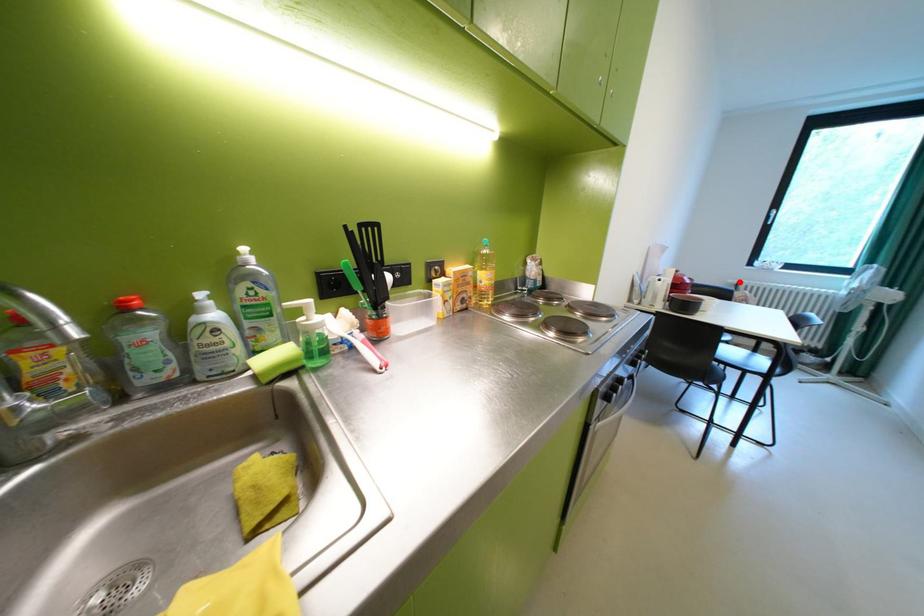
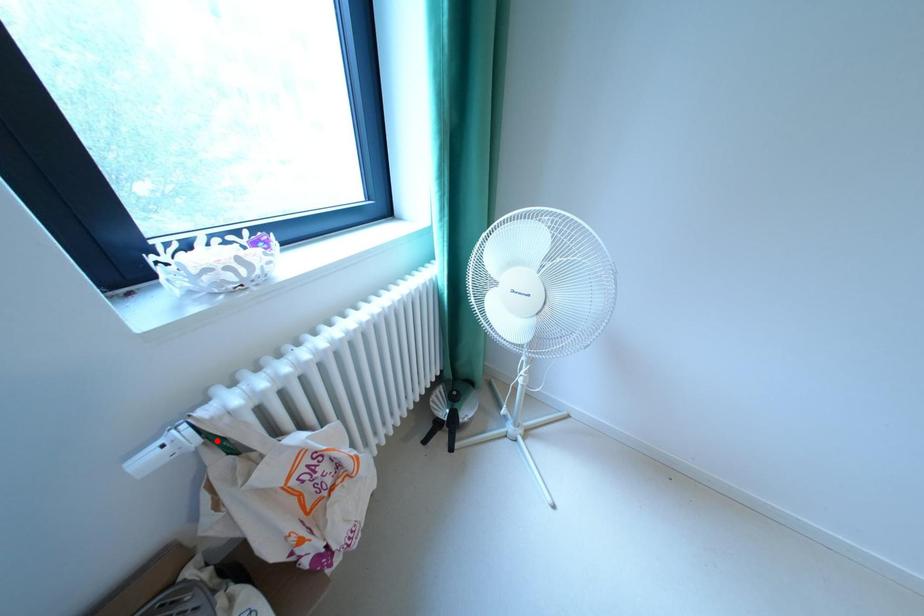
I am providing you with two images of the same scene from different viewpoints. A red point is marked on the first image and another point is marked on the second image. Is the red point in image1 aligned with the point shown in image2?

No